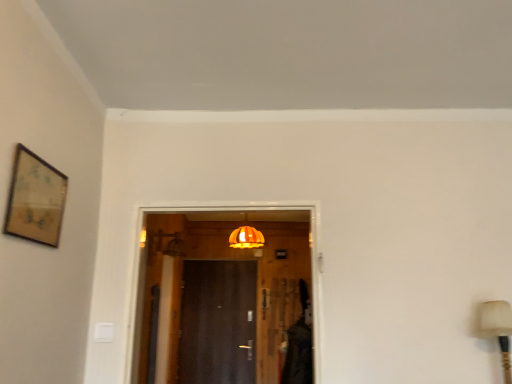
Question: Does dark wood door at center appear on the left side of wooden framed artwork at upper left?

Choices:
 (A) no
 (B) yes

Answer: (A)

Question: Is dark wood door at center beside wooden framed artwork at upper left?

Choices:
 (A) yes
 (B) no

Answer: (B)

Question: Is the depth of dark wood door at center greater than that of wooden framed artwork at upper left?

Choices:
 (A) yes
 (B) no

Answer: (A)

Question: From a real-world perspective, is dark wood door at center located higher than wooden framed artwork at upper left?

Choices:
 (A) no
 (B) yes

Answer: (A)

Question: Does dark wood door at center have a smaller size compared to wooden framed artwork at upper left?

Choices:
 (A) no
 (B) yes

Answer: (A)

Question: From a real-world perspective, is dark wood door at center below wooden framed artwork at upper left?

Choices:
 (A) no
 (B) yes

Answer: (B)

Question: Is wooden framed artwork at upper left not near dark wood door at center?

Choices:
 (A) no
 (B) yes

Answer: (B)

Question: Is wooden framed artwork at upper left outside dark wood door at center?

Choices:
 (A) no
 (B) yes

Answer: (B)

Question: Is wooden framed artwork at upper left bigger than dark wood door at center?

Choices:
 (A) yes
 (B) no

Answer: (B)

Question: Can you confirm if wooden framed artwork at upper left is positioned to the left of dark wood door at center?

Choices:
 (A) yes
 (B) no

Answer: (A)

Question: Does wooden framed artwork at upper left come in front of dark wood door at center?

Choices:
 (A) yes
 (B) no

Answer: (A)

Question: Considering the relative sizes of wooden framed artwork at upper left and dark wood door at center in the image provided, is wooden framed artwork at upper left shorter than dark wood door at center?

Choices:
 (A) yes
 (B) no

Answer: (A)

Question: Is wooden framed artwork at upper left outside orange fabric lampshade at center?

Choices:
 (A) no
 (B) yes

Answer: (B)